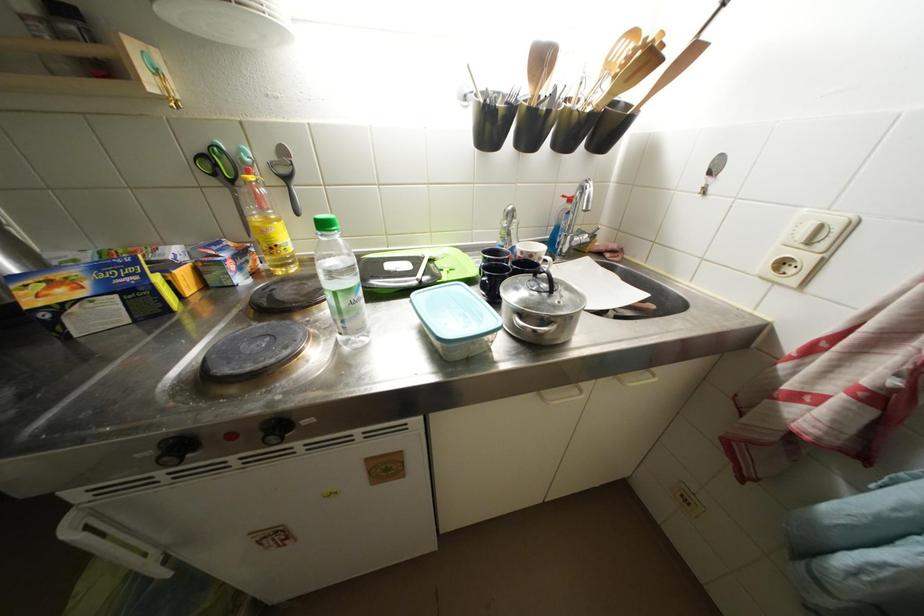
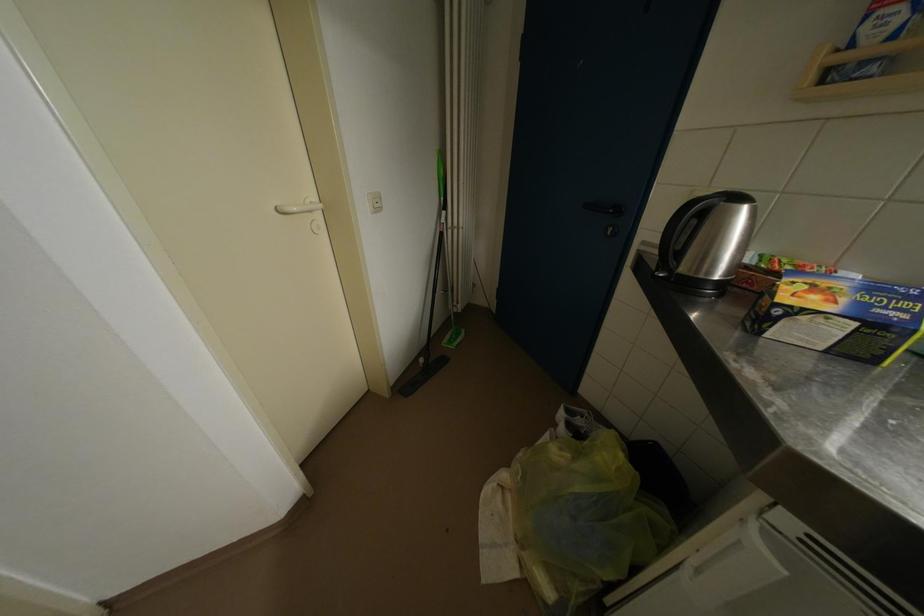
Where in the second image is the point corresponding to the point at 39,307 from the first image?

(791, 302)